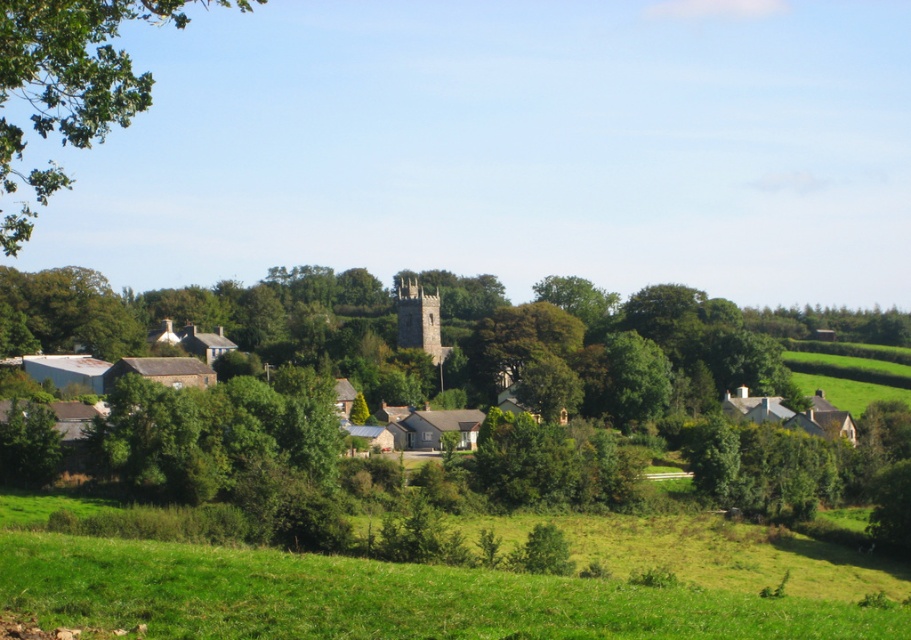
Question: Is green grassy field at lower center thinner than green leafy tree at upper left?

Choices:
 (A) no
 (B) yes

Answer: (B)

Question: Is green grassy field at lower center to the right of stone steeple at center from the viewer's perspective?

Choices:
 (A) no
 (B) yes

Answer: (B)

Question: Can you confirm if green grassy field at lower center is positioned above green leafy tree at upper left?

Choices:
 (A) yes
 (B) no

Answer: (B)

Question: Which of the following is the farthest from the observer?

Choices:
 (A) (398, 340)
 (B) (461, 589)
 (C) (21, 54)

Answer: (A)

Question: Which object is positioned closest to the stone steeple at center?

Choices:
 (A) green leafy tree at upper left
 (B) green grassy field at lower center

Answer: (A)

Question: Which point is closer to the camera?

Choices:
 (A) (18, 227)
 (B) (416, 298)

Answer: (A)